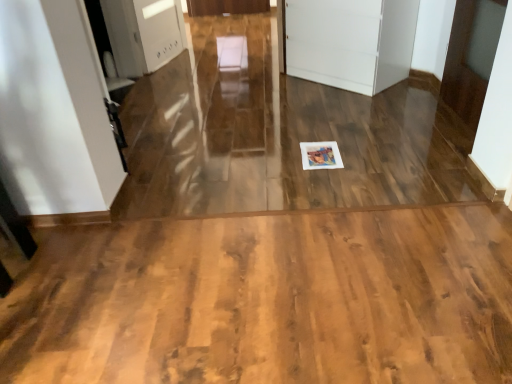
The width and height of the screenshot is (512, 384). I want to click on free space to the left of white glossy door at upper right, which is counted as the 1th door, starting from the right, so click(x=396, y=122).